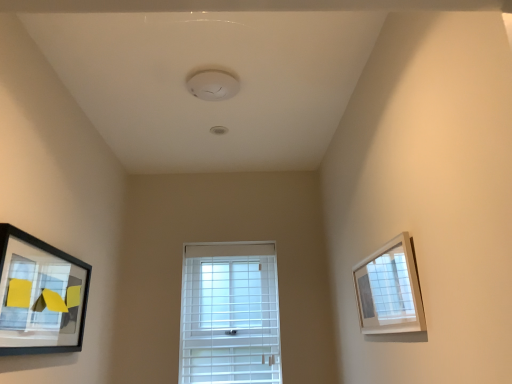
Question: Should I look upward or downward to see white plastic window at center?

Choices:
 (A) down
 (B) up

Answer: (A)

Question: From the image's perspective, does white plastic window at center appear higher than matte black picture frame at left, positioned as the 1th picture frame in left-to-right order?

Choices:
 (A) no
 (B) yes

Answer: (A)

Question: Is white plastic window at center not close to matte black picture frame at left, which is counted as the 2th picture frame, starting from the right?

Choices:
 (A) no
 (B) yes

Answer: (B)

Question: Is white plastic window at center closer to the viewer compared to matte black picture frame at left, positioned as the 1th picture frame in left-to-right order?

Choices:
 (A) yes
 (B) no

Answer: (B)

Question: Is white plastic window at center smaller than matte black picture frame at left, which is counted as the 2th picture frame, starting from the right?

Choices:
 (A) no
 (B) yes

Answer: (A)

Question: Is white plastic window at center completely or partially outside of matte black picture frame at left, which is counted as the 2th picture frame, starting from the right?

Choices:
 (A) no
 (B) yes

Answer: (B)

Question: Can you confirm if white plastic window at center is taller than matte black picture frame at left, which is counted as the 2th picture frame, starting from the right?

Choices:
 (A) no
 (B) yes

Answer: (B)

Question: Is matte black picture frame at left, which is counted as the 2th picture frame, starting from the right, positioned with its back to white matte picture frame at upper right, acting as the 1th picture frame starting from the right?

Choices:
 (A) no
 (B) yes

Answer: (A)

Question: From a real-world perspective, is matte black picture frame at left, positioned as the 1th picture frame in left-to-right order, physically below white matte picture frame at upper right, which ranks as the 2th picture frame in left-to-right order?

Choices:
 (A) yes
 (B) no

Answer: (B)

Question: Considering the relative sizes of matte black picture frame at left, which is counted as the 2th picture frame, starting from the right, and white matte picture frame at upper right, which ranks as the 2th picture frame in left-to-right order, in the image provided, is matte black picture frame at left, which is counted as the 2th picture frame, starting from the right, taller than white matte picture frame at upper right, which ranks as the 2th picture frame in left-to-right order,?

Choices:
 (A) yes
 (B) no

Answer: (A)

Question: Does matte black picture frame at left, which is counted as the 2th picture frame, starting from the right, have a lesser width compared to white matte picture frame at upper right, acting as the 1th picture frame starting from the right?

Choices:
 (A) no
 (B) yes

Answer: (A)

Question: Can you confirm if matte black picture frame at left, positioned as the 1th picture frame in left-to-right order, is positioned to the right of white matte picture frame at upper right, acting as the 1th picture frame starting from the right?

Choices:
 (A) no
 (B) yes

Answer: (A)

Question: From a real-world perspective, is matte black picture frame at left, positioned as the 1th picture frame in left-to-right order, positioned over white matte picture frame at upper right, which ranks as the 2th picture frame in left-to-right order, based on gravity?

Choices:
 (A) no
 (B) yes

Answer: (B)

Question: Is white plastic window at center in contact with white matte picture frame at upper right, which ranks as the 2th picture frame in left-to-right order?

Choices:
 (A) no
 (B) yes

Answer: (A)